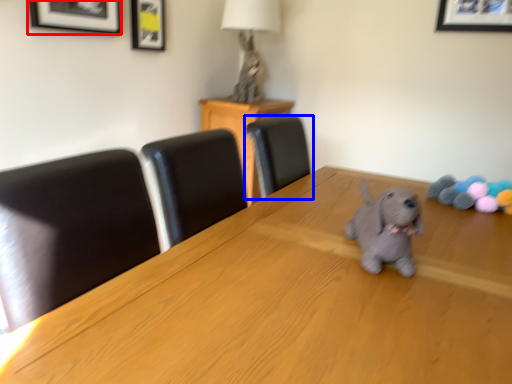
Question: Among these objects, which one is nearest to the camera, picture frame (highlighted by a red box) or chair (highlighted by a blue box)?

Choices:
 (A) picture frame
 (B) chair

Answer: (A)